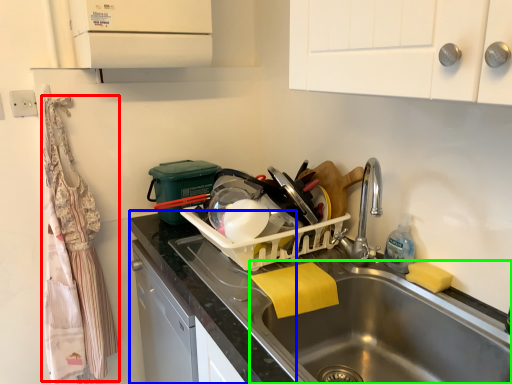
Question: Estimate the real-world distances between objects in this image. Which object is farther from material (highlighted by a red box), counter top (highlighted by a blue box) or sink (highlighted by a green box)?

Choices:
 (A) counter top
 (B) sink

Answer: (B)